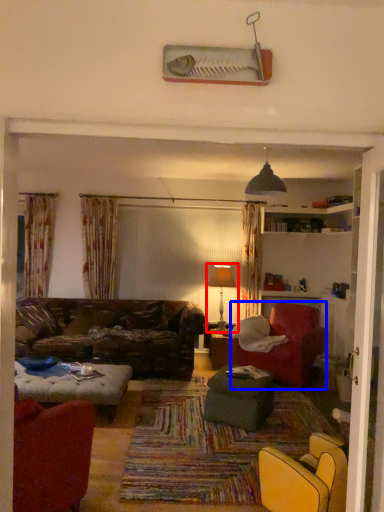
Question: Which of the following is the farthest to the observer, table lamp (highlighted by a red box) or chair (highlighted by a blue box)?

Choices:
 (A) table lamp
 (B) chair

Answer: (A)